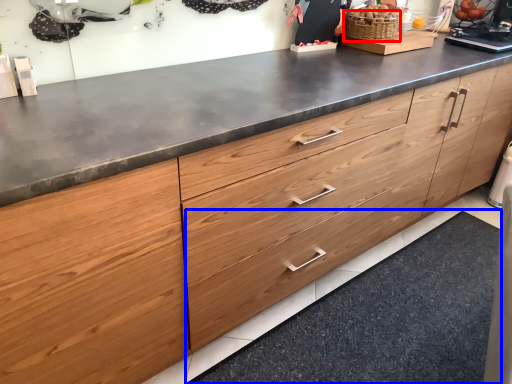
Question: Among these objects, which one is farthest to the camera, basket (highlighted by a red box) or granite (highlighted by a blue box)?

Choices:
 (A) basket
 (B) granite

Answer: (A)